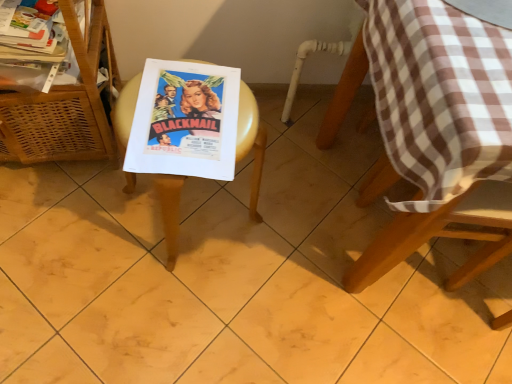
In order to click on free space to the left of wooden picnic table at center in this screenshot , I will do `click(83, 225)`.